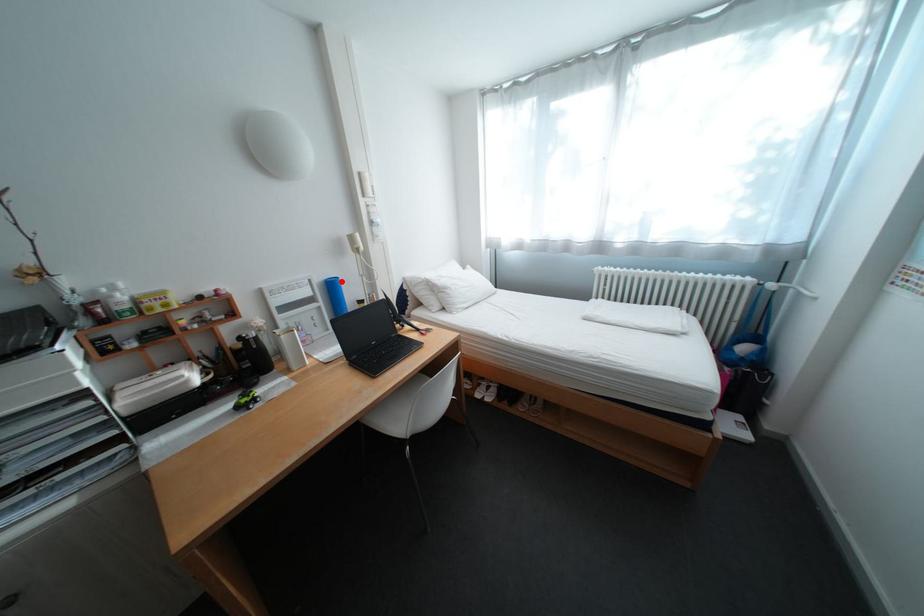
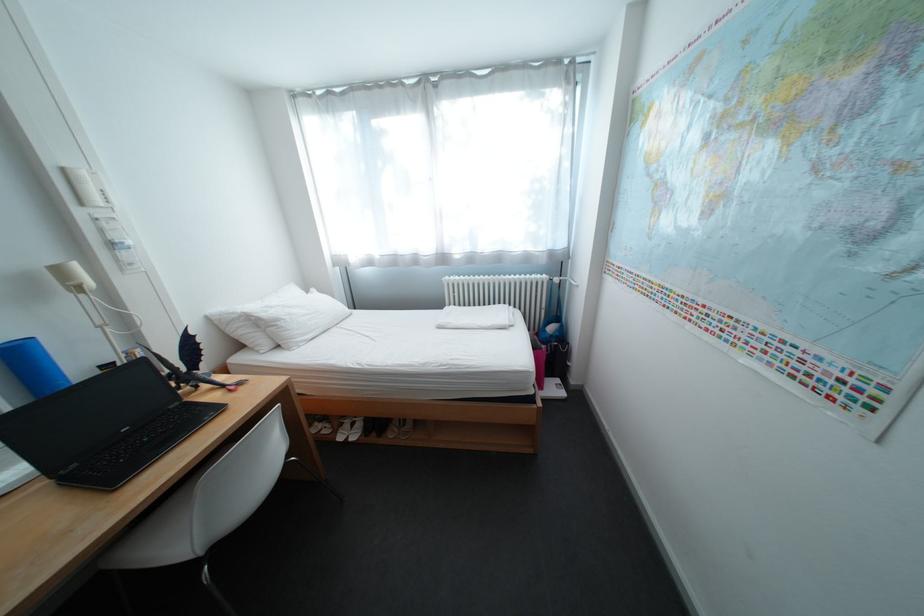
Where in the second image is the point corresponding to the highlighted location from the first image?

(17, 347)